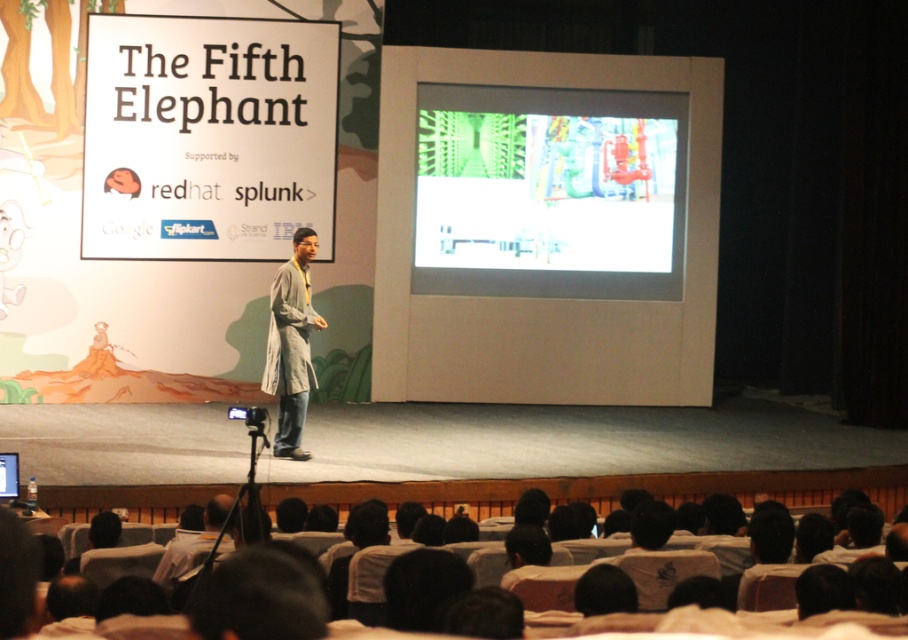
You are an attendee at the conference and notice two white objects on the stage. One is the white paper at upper left and the other is the white glossy projection screen at center. Which of these two objects is taller?

The white paper at upper left has a greater height compared to the white glossy projection screen at center, so the white paper at upper left is taller.

You are an attendee at the conference and want to take a photo of the speaker. The speaker is wearing a gray fabric coat at center. Where should you position yourself to capture the coat clearly in your shot?

The gray fabric coat at center is located at point (291, 344), so you should position yourself directly in front of the speaker to ensure the coat is centered in your photo.